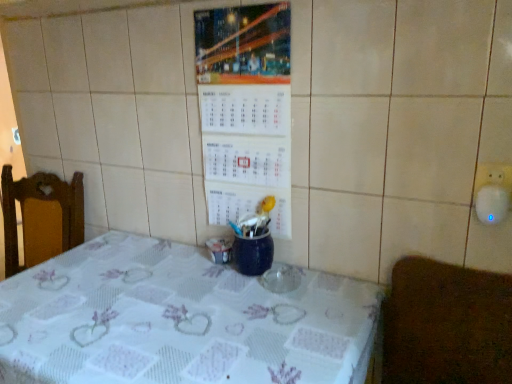
Question: Is the surface of brown textured mat at lower right in direct contact with white printed tablecloth at center?

Choices:
 (A) no
 (B) yes

Answer: (A)

Question: Could white printed tablecloth at center be considered to be inside brown textured mat at lower right?

Choices:
 (A) no
 (B) yes

Answer: (A)

Question: Can you confirm if brown textured mat at lower right is smaller than white printed tablecloth at center?

Choices:
 (A) yes
 (B) no

Answer: (A)

Question: Considering the relative sizes of brown textured mat at lower right and white printed tablecloth at center in the image provided, is brown textured mat at lower right wider than white printed tablecloth at center?

Choices:
 (A) no
 (B) yes

Answer: (A)

Question: Is brown textured mat at lower right completely or partially outside of white printed tablecloth at center?

Choices:
 (A) yes
 (B) no

Answer: (A)

Question: Does brown textured mat at lower right appear on the right side of white printed tablecloth at center?

Choices:
 (A) yes
 (B) no

Answer: (A)

Question: Considering the relative positions of white printed tablecloth at center and white paper calendar at center in the image provided, is white printed tablecloth at center to the right of white paper calendar at center from the viewer's perspective?

Choices:
 (A) yes
 (B) no

Answer: (B)

Question: From the image's perspective, is white printed tablecloth at center below white paper calendar at center?

Choices:
 (A) yes
 (B) no

Answer: (A)

Question: Could you tell me if white printed tablecloth at center is turned towards white paper calendar at center?

Choices:
 (A) yes
 (B) no

Answer: (B)

Question: Can you confirm if white printed tablecloth at center is shorter than white paper calendar at center?

Choices:
 (A) no
 (B) yes

Answer: (A)

Question: Is white printed tablecloth at center wider than white paper calendar at center?

Choices:
 (A) no
 (B) yes

Answer: (B)

Question: From a real-world perspective, is white printed tablecloth at center beneath white paper calendar at center?

Choices:
 (A) no
 (B) yes

Answer: (B)

Question: Is the depth of white printed tablecloth at center less than that of brown textured mat at lower right?

Choices:
 (A) yes
 (B) no

Answer: (B)